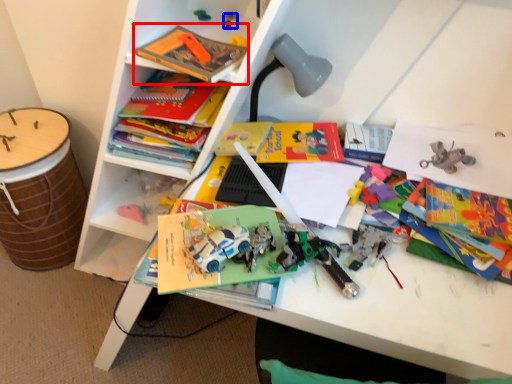
Question: Which object appears closest to the camera in this image, book (highlighted by a red box) or toy (highlighted by a blue box)?

Choices:
 (A) book
 (B) toy

Answer: (A)